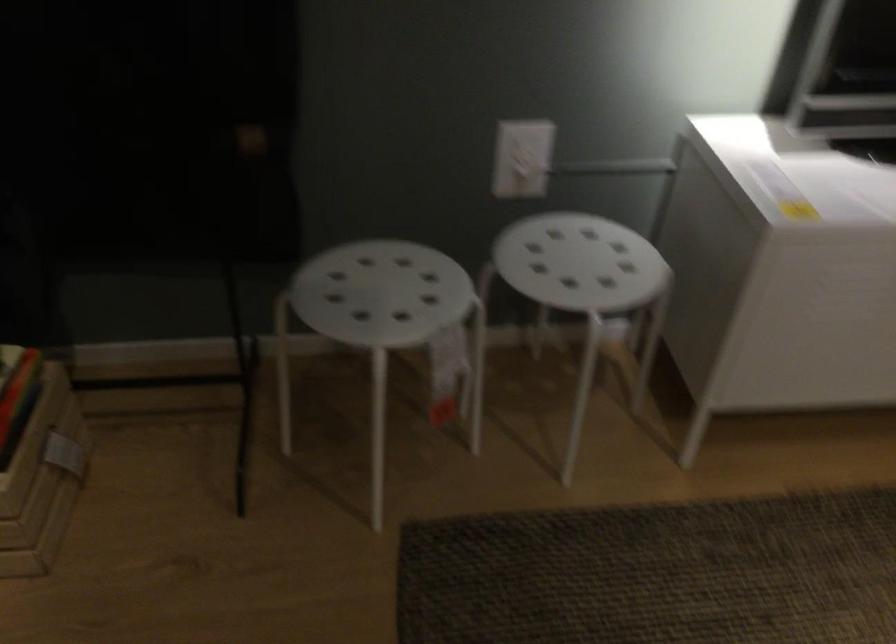
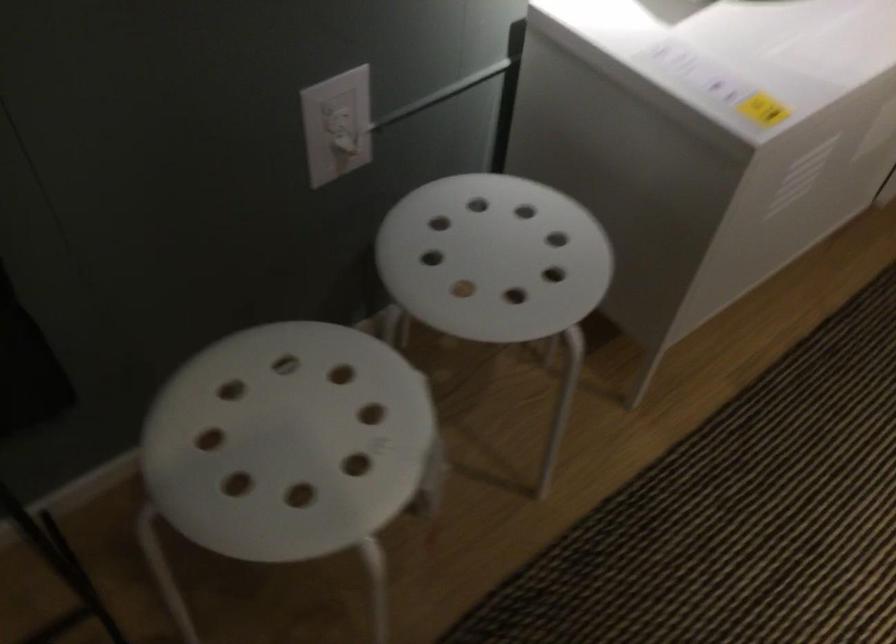
In the second image, find the point that corresponds to (x=574, y=261) in the first image.

(494, 258)